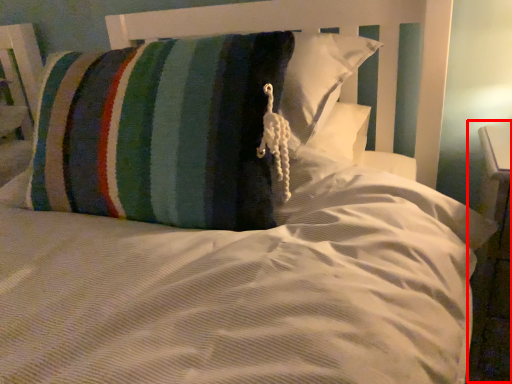
Question: From the image, what is the correct spatial relationship of dresser (annotated by the red box) in relation to pillow?

Choices:
 (A) right
 (B) left

Answer: (A)